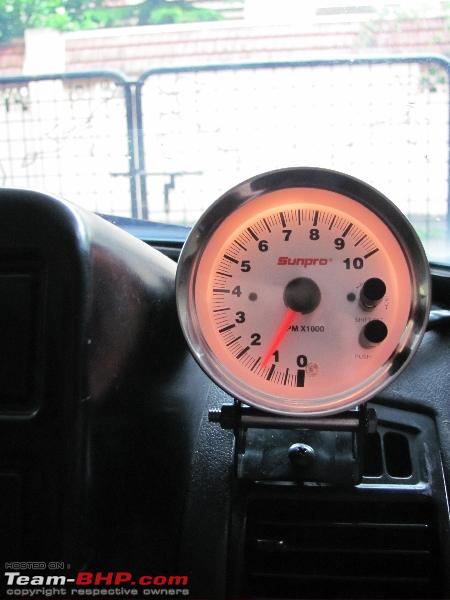
Where is `light`? light is located at coordinates (295, 205).